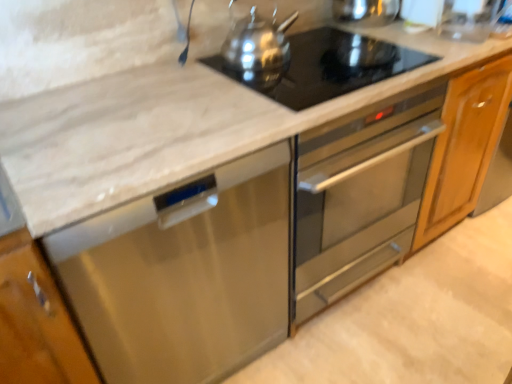
At what (x,y) coordinates should I click in order to perform the action: click on vacant area situated below black glass cooktop at upper center (from a real-world perspective). Please return your answer as a coordinate pair (x, y). The width and height of the screenshot is (512, 384). Looking at the image, I should click on (330, 65).